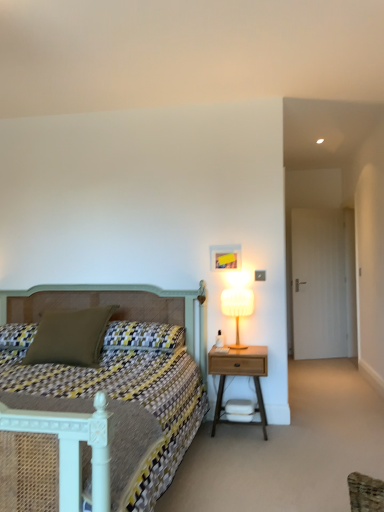
Question: From the image's perspective, is patterned fabric bed at center located above matte green pillow at left, the first pillow positioned from the left?

Choices:
 (A) yes
 (B) no

Answer: (B)

Question: Does patterned fabric bed at center appear on the right side of matte green pillow at left, the first pillow positioned from the left?

Choices:
 (A) no
 (B) yes

Answer: (A)

Question: Is patterned fabric bed at center surrounding matte green pillow at left, the first pillow positioned from the left?

Choices:
 (A) yes
 (B) no

Answer: (A)

Question: Is patterned fabric bed at center in contact with matte green pillow at left, the first pillow positioned from the left?

Choices:
 (A) yes
 (B) no

Answer: (B)

Question: Can you confirm if patterned fabric bed at center is smaller than matte green pillow at left, the first pillow positioned from the left?

Choices:
 (A) no
 (B) yes

Answer: (A)

Question: Does patterned fabric bed at center have a greater width compared to matte green pillow at left, the second pillow positioned from the right?

Choices:
 (A) no
 (B) yes

Answer: (B)

Question: Is wooden nightstand at right at the right side of matte green pillow at left, the first pillow positioned from the left?

Choices:
 (A) yes
 (B) no

Answer: (A)

Question: Considering the relative sizes of wooden nightstand at right and matte green pillow at left, the first pillow positioned from the left, in the image provided, is wooden nightstand at right smaller than matte green pillow at left, the first pillow positioned from the left,?

Choices:
 (A) yes
 (B) no

Answer: (A)

Question: Does wooden nightstand at right lie in front of matte green pillow at left, the first pillow positioned from the left?

Choices:
 (A) no
 (B) yes

Answer: (A)

Question: Considering the relative positions of wooden nightstand at right and matte green pillow at left, the second pillow positioned from the right, in the image provided, is wooden nightstand at right to the left of matte green pillow at left, the second pillow positioned from the right, from the viewer's perspective?

Choices:
 (A) no
 (B) yes

Answer: (A)

Question: Is wooden nightstand at right with matte green pillow at left, the first pillow positioned from the left?

Choices:
 (A) no
 (B) yes

Answer: (A)

Question: From the image's perspective, would you say wooden nightstand at right is shown under matte green pillow at left, the first pillow positioned from the left?

Choices:
 (A) no
 (B) yes

Answer: (B)

Question: Is white fabric lampshade at right positioned far away from textured olive green pillow at center-left, which appears as the 2th pillow when viewed from the left?

Choices:
 (A) no
 (B) yes

Answer: (A)